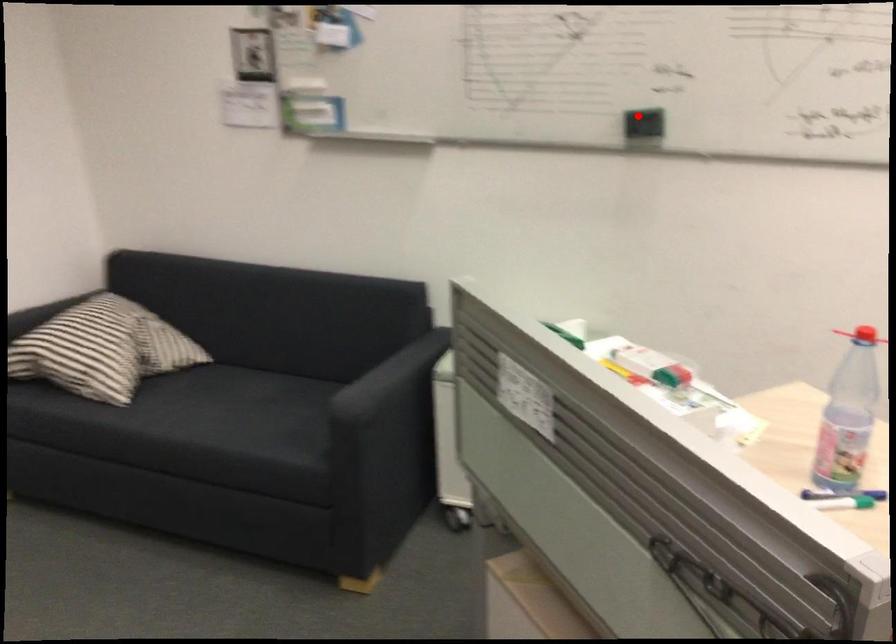
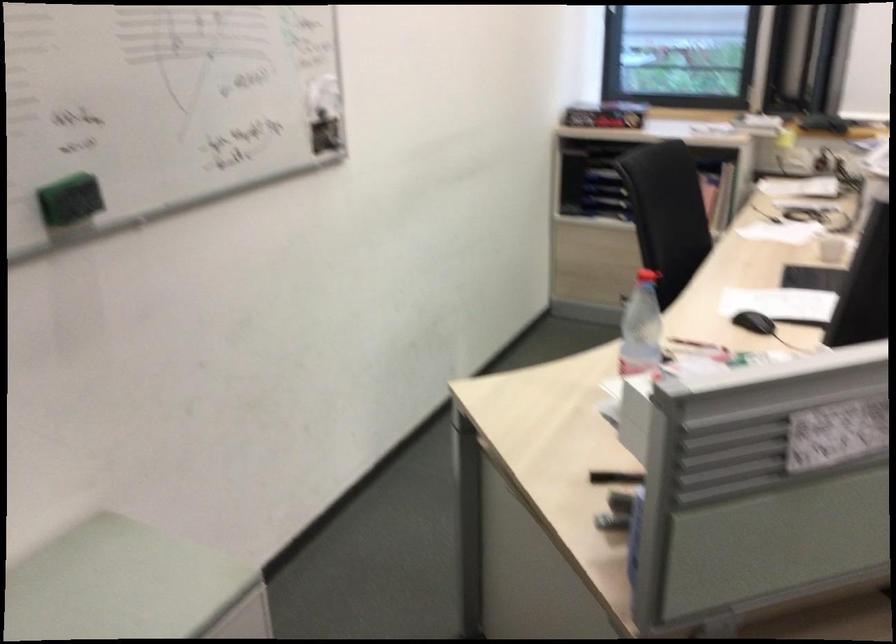
The point at the highlighted location is marked in the first image. Where is the corresponding point in the second image?

(70, 200)